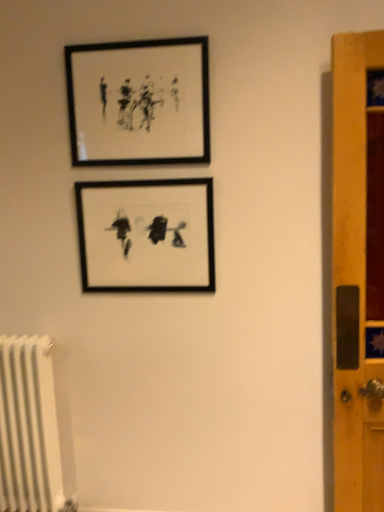
How much space does black matte picture frame at upper center, positioned as the first picture frame in top-to-bottom order, occupy vertically?

The height of black matte picture frame at upper center, positioned as the first picture frame in top-to-bottom order, is 17.45 inches.

Image resolution: width=384 pixels, height=512 pixels. Describe the element at coordinates (139, 102) in the screenshot. I see `black matte picture frame at upper center, positioned as the first picture frame in top-to-bottom order` at that location.

Find the location of a particular element. This screenshot has width=384, height=512. black matte picture frame at upper center, positioned as the first picture frame in top-to-bottom order is located at coordinates (139, 102).

The height and width of the screenshot is (512, 384). What do you see at coordinates (146, 234) in the screenshot?
I see `black matte picture frame at center, marked as the 1th picture frame in a bottom-to-top arrangement` at bounding box center [146, 234].

Find the location of a particular element. This screenshot has height=512, width=384. black matte picture frame at center, marked as the 1th picture frame in a bottom-to-top arrangement is located at coordinates (146, 234).

The image size is (384, 512). In order to click on black matte picture frame at upper center, positioned as the first picture frame in top-to-bottom order in this screenshot , I will do `click(139, 102)`.

From the picture: Considering the relative positions of black matte picture frame at upper center, which is counted as the 2th picture frame, starting from the bottom, and black matte picture frame at center, marked as the 1th picture frame in a bottom-to-top arrangement, in the image provided, is black matte picture frame at upper center, which is counted as the 2th picture frame, starting from the bottom, to the right of black matte picture frame at center, marked as the 1th picture frame in a bottom-to-top arrangement, from the viewer's perspective?

No.

In the image, is black matte picture frame at upper center, which is counted as the 2th picture frame, starting from the bottom, positioned in front of or behind black matte picture frame at center, marked as the 1th picture frame in a bottom-to-top arrangement?

Visually, black matte picture frame at upper center, which is counted as the 2th picture frame, starting from the bottom, is located in front of black matte picture frame at center, marked as the 1th picture frame in a bottom-to-top arrangement.

Is point (161, 159) closer or farther from the camera than point (128, 186)?

Clearly, point (161, 159) is closer to the camera than point (128, 186).

From the image's perspective, is black matte picture frame at upper center, positioned as the first picture frame in top-to-bottom order, under black matte picture frame at center, marked as the 1th picture frame in a bottom-to-top arrangement?

No.

From a real-world perspective, which is physically below, black matte picture frame at upper center, which is counted as the 2th picture frame, starting from the bottom, or black matte picture frame at center, arranged as the 2th picture frame when viewed from the top?

From a 3D spatial view, black matte picture frame at center, arranged as the 2th picture frame when viewed from the top, is below.

Is black matte picture frame at upper center, which is counted as the 2th picture frame, starting from the bottom, wider than black matte picture frame at center, arranged as the 2th picture frame when viewed from the top?

Indeed, black matte picture frame at upper center, which is counted as the 2th picture frame, starting from the bottom, has a greater width compared to black matte picture frame at center, arranged as the 2th picture frame when viewed from the top.

Which of these two, black matte picture frame at upper center, which is counted as the 2th picture frame, starting from the bottom, or black matte picture frame at center, arranged as the 2th picture frame when viewed from the top, stands shorter?

With less height is black matte picture frame at upper center, which is counted as the 2th picture frame, starting from the bottom.

Which of these two, black matte picture frame at upper center, which is counted as the 2th picture frame, starting from the bottom, or black matte picture frame at center, marked as the 1th picture frame in a bottom-to-top arrangement, is bigger?

With larger size is black matte picture frame at upper center, which is counted as the 2th picture frame, starting from the bottom.

From the picture: Is black matte picture frame at center, marked as the 1th picture frame in a bottom-to-top arrangement, completely or partially inside black matte picture frame at upper center, positioned as the first picture frame in top-to-bottom order?

Definitely not — black matte picture frame at center, marked as the 1th picture frame in a bottom-to-top arrangement, is not inside black matte picture frame at upper center, positioned as the first picture frame in top-to-bottom order.

Is black matte picture frame at upper center, positioned as the first picture frame in top-to-bottom order, placed right next to black matte picture frame at center, marked as the 1th picture frame in a bottom-to-top arrangement?

black matte picture frame at upper center, positioned as the first picture frame in top-to-bottom order, and black matte picture frame at center, marked as the 1th picture frame in a bottom-to-top arrangement, are clearly separated.

Could you tell me if black matte picture frame at upper center, which is counted as the 2th picture frame, starting from the bottom, is turned towards black matte picture frame at center, marked as the 1th picture frame in a bottom-to-top arrangement?

No, black matte picture frame at upper center, which is counted as the 2th picture frame, starting from the bottom, is not turned towards black matte picture frame at center, marked as the 1th picture frame in a bottom-to-top arrangement.

How much distance is there between black matte picture frame at upper center, which is counted as the 2th picture frame, starting from the bottom, and black matte picture frame at center, marked as the 1th picture frame in a bottom-to-top arrangement?

The distance of black matte picture frame at upper center, which is counted as the 2th picture frame, starting from the bottom, from black matte picture frame at center, marked as the 1th picture frame in a bottom-to-top arrangement, is 11.35 inches.

You are a GUI agent. You are given a task and a screenshot of the screen. Output one action in this format:
    pyautogui.click(x=<x>, y=<y>)
    Task: Click on the picture frame below the black matte picture frame at upper center, positioned as the first picture frame in top-to-bottom order (from the image's perspective)
    Image resolution: width=384 pixels, height=512 pixels.
    Given the screenshot: What is the action you would take?
    pyautogui.click(x=146, y=234)

Visually, is black matte picture frame at center, arranged as the 2th picture frame when viewed from the top, positioned to the left or to the right of black matte picture frame at upper center, which is counted as the 2th picture frame, starting from the bottom?

From the image, it's evident that black matte picture frame at center, arranged as the 2th picture frame when viewed from the top, is to the right of black matte picture frame at upper center, which is counted as the 2th picture frame, starting from the bottom.

Which is in front, black matte picture frame at center, marked as the 1th picture frame in a bottom-to-top arrangement, or black matte picture frame at upper center, which is counted as the 2th picture frame, starting from the bottom?

Positioned in front is black matte picture frame at upper center, which is counted as the 2th picture frame, starting from the bottom.

Which point is more distant from viewer, (130, 198) or (194, 162)?

Positioned behind is point (130, 198).

From the image's perspective, which is above, black matte picture frame at center, arranged as the 2th picture frame when viewed from the top, or black matte picture frame at upper center, which is counted as the 2th picture frame, starting from the bottom?

From the image's view, black matte picture frame at upper center, which is counted as the 2th picture frame, starting from the bottom, is above.

From a real-world perspective, who is located lower, black matte picture frame at center, marked as the 1th picture frame in a bottom-to-top arrangement, or black matte picture frame at upper center, which is counted as the 2th picture frame, starting from the bottom?

In real-world perspective, black matte picture frame at center, marked as the 1th picture frame in a bottom-to-top arrangement, is lower.

Considering the sizes of objects black matte picture frame at center, arranged as the 2th picture frame when viewed from the top, and black matte picture frame at upper center, positioned as the first picture frame in top-to-bottom order, in the image provided, who is thinner, black matte picture frame at center, arranged as the 2th picture frame when viewed from the top, or black matte picture frame at upper center, positioned as the first picture frame in top-to-bottom order,?

With smaller width is black matte picture frame at center, arranged as the 2th picture frame when viewed from the top.

Which of these two, black matte picture frame at center, marked as the 1th picture frame in a bottom-to-top arrangement, or black matte picture frame at upper center, which is counted as the 2th picture frame, starting from the bottom, stands taller?

black matte picture frame at center, marked as the 1th picture frame in a bottom-to-top arrangement.

Between black matte picture frame at center, arranged as the 2th picture frame when viewed from the top, and black matte picture frame at upper center, positioned as the first picture frame in top-to-bottom order, which one has smaller size?

Smaller between the two is black matte picture frame at center, arranged as the 2th picture frame when viewed from the top.

Is black matte picture frame at center, arranged as the 2th picture frame when viewed from the top, spatially inside black matte picture frame at upper center, which is counted as the 2th picture frame, starting from the bottom, or outside of it?

The correct answer is: outside.

Would you say black matte picture frame at center, marked as the 1th picture frame in a bottom-to-top arrangement, is a long distance from black matte picture frame at upper center, positioned as the first picture frame in top-to-bottom order?

They are positioned close to each other.

Is black matte picture frame at center, arranged as the 2th picture frame when viewed from the top, oriented towards black matte picture frame at upper center, positioned as the first picture frame in top-to-bottom order?

No, black matte picture frame at center, arranged as the 2th picture frame when viewed from the top, is not turned towards black matte picture frame at upper center, positioned as the first picture frame in top-to-bottom order.

Could you measure the distance between black matte picture frame at center, marked as the 1th picture frame in a bottom-to-top arrangement, and black matte picture frame at upper center, positioned as the first picture frame in top-to-bottom order?

They are 11.35 inches apart.

At what (x,y) coordinates should I click in order to perform the action: click on picture frame below the black matte picture frame at upper center, positioned as the first picture frame in top-to-bottom order (from a real-world perspective). Please return your answer as a coordinate pair (x, y). The height and width of the screenshot is (512, 384). Looking at the image, I should click on (146, 234).

The width and height of the screenshot is (384, 512). Identify the location of picture frame on the right of black matte picture frame at upper center, which is counted as the 2th picture frame, starting from the bottom. (146, 234).

The image size is (384, 512). There is a black matte picture frame at center, marked as the 1th picture frame in a bottom-to-top arrangement. Identify the location of picture frame above it (from a real-world perspective). (139, 102).